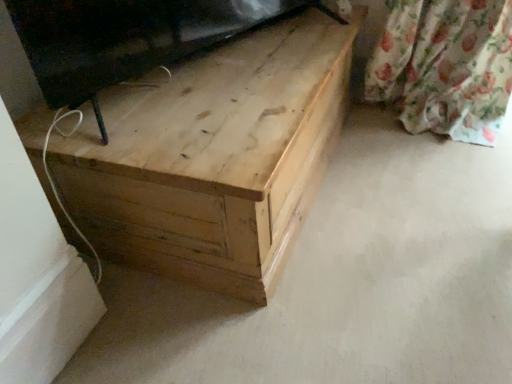
You are a GUI agent. You are given a task and a screenshot of the screen. Output one action in this format:
    pyautogui.click(x=<x>, y=<y>)
    Task: Click on the vacant area to the right of natural wood chest at center
    
    Given the screenshot: What is the action you would take?
    pyautogui.click(x=407, y=177)